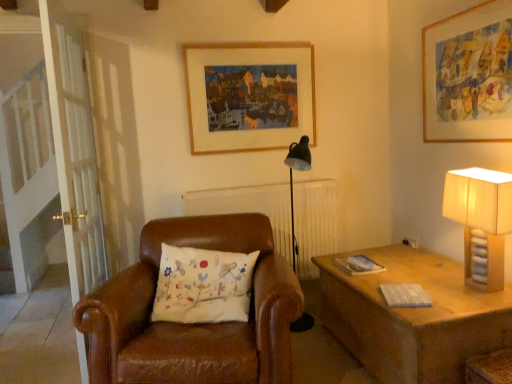
Question: From a real-world perspective, is white wooden screen door at left physically located above or below beige fabric lampshade at right?

Choices:
 (A) below
 (B) above

Answer: (B)

Question: Choose the correct answer: Is white wooden screen door at left inside beige fabric lampshade at right or outside it?

Choices:
 (A) outside
 (B) inside

Answer: (A)

Question: Estimate the real-world distances between objects in this image. Which object is closer to the white embroidered pillow at center?

Choices:
 (A) wooden picture frame at upper center, the 2th picture frame when ordered from front to back
 (B) wooden picture frame at upper right, the second picture frame viewed from the left
 (C) white wooden screen door at left
 (D) beige fabric lampshade at right

Answer: (C)

Question: Estimate the real-world distances between objects in this image. Which object is closer to the white embroidered pillow at center?

Choices:
 (A) wooden picture frame at upper center, which is the 1th picture frame in left-to-right order
 (B) white wooden screen door at left
 (C) beige fabric lampshade at right
 (D) wooden picture frame at upper right, the second picture frame positioned from the back

Answer: (B)